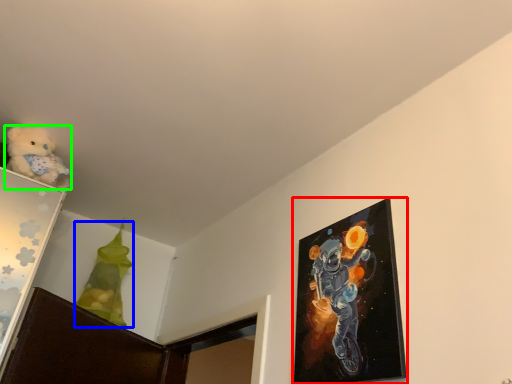
Question: Which object is positioned closest to picture frame (highlighted by a red box)? Select from toy (highlighted by a blue box) and teddy bear (highlighted by a green box).

Choices:
 (A) toy
 (B) teddy bear

Answer: (B)